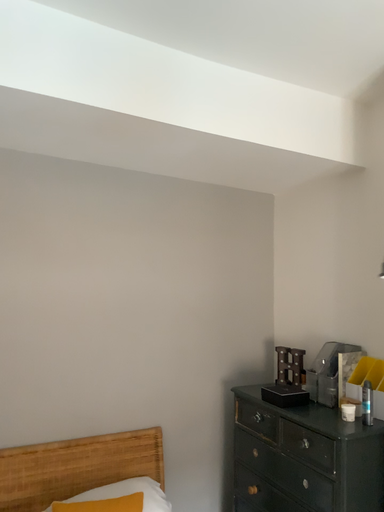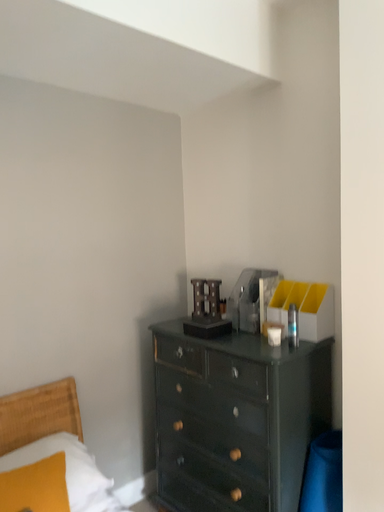
Question: Which way did the camera rotate in the video?

Choices:
 (A) rotated upward
 (B) rotated downward

Answer: (B)